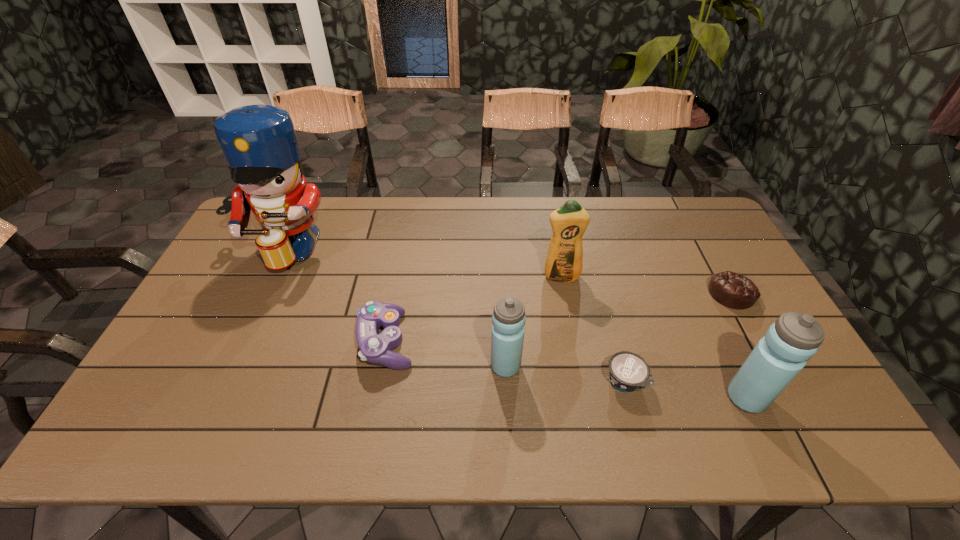
Identify the location of object identified as the second closest to the fourth object from left to right. Image resolution: width=960 pixels, height=540 pixels. (628, 372).

I want to click on vacant space that satisfies the following two spatial constraints: 1. on the front-facing side of the leftmost object; 2. on the right side of the control, so click(x=241, y=341).

Locate an element on the screen. Image resolution: width=960 pixels, height=540 pixels. free space that satisfies the following two spatial constraints: 1. on the front-facing side of the nutcracker; 2. on the left side of the third object from right to left is located at coordinates (222, 381).

The height and width of the screenshot is (540, 960). I want to click on free region that satisfies the following two spatial constraints: 1. on the front-facing side of the leftmost object; 2. on the left side of the second object from left to right, so click(241, 341).

Find the location of `vacant position in the image that satisfies the following two spatial constraints: 1. on the front-facing side of the leftmost object; 2. on the right side of the yogurt`. vacant position in the image that satisfies the following two spatial constraints: 1. on the front-facing side of the leftmost object; 2. on the right side of the yogurt is located at coordinates (222, 381).